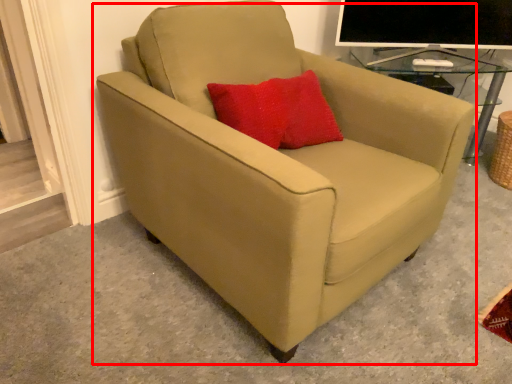
Question: From the image's perspective, what is the correct spatial relationship of chair (annotated by the red box) in relation to computer monitor?

Choices:
 (A) above
 (B) below

Answer: (B)